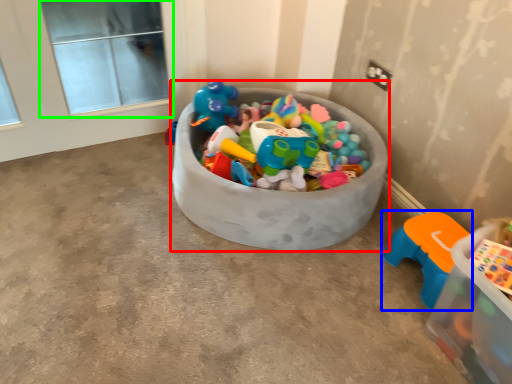
Question: Considering the real-world distances, which object is farthest from storage box (highlighted by a red box)? toy (highlighted by a blue box) or window screen (highlighted by a green box)?

Choices:
 (A) toy
 (B) window screen

Answer: (B)